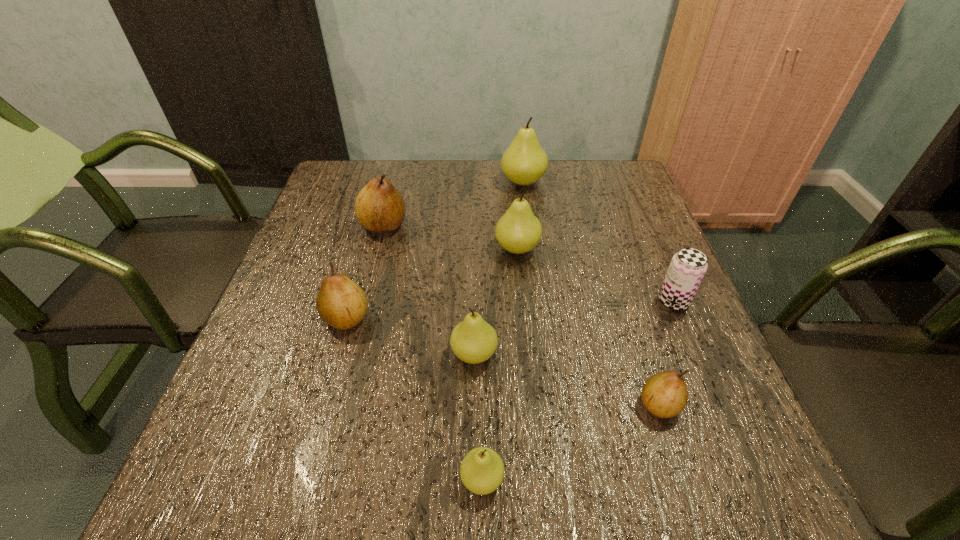
I want to click on free spot at the near right corner of the desktop, so click(682, 485).

The image size is (960, 540). Identify the location of free area in between the second nearest pear and the biggest brown pear. (521, 315).

Where is `free space that is in between the farthest object and the second nearest brown pear`? The height and width of the screenshot is (540, 960). free space that is in between the farthest object and the second nearest brown pear is located at coordinates (435, 250).

Where is `free space between the second smallest brown pear and the second biggest green pear`? This screenshot has width=960, height=540. free space between the second smallest brown pear and the second biggest green pear is located at coordinates point(432,284).

Locate an element on the screen. The width and height of the screenshot is (960, 540). free space between the rightmost object and the farthest pear is located at coordinates (598, 241).

Locate an element on the screen. This screenshot has height=540, width=960. empty space between the rightmost brown pear and the third smallest green pear is located at coordinates (588, 327).

This screenshot has width=960, height=540. What are the coordinates of `vacant area between the rightmost object and the biggest brown pear` in the screenshot? It's located at (528, 264).

This screenshot has width=960, height=540. I want to click on empty space between the farthest brown pear and the tallest pear, so click(453, 204).

Locate an element on the screen. Image resolution: width=960 pixels, height=540 pixels. unoccupied position between the third nearest green pear and the purple beer can is located at coordinates (595, 274).

Image resolution: width=960 pixels, height=540 pixels. Find the location of `empty space that is in between the third biggest green pear and the biggest brown pear`. empty space that is in between the third biggest green pear and the biggest brown pear is located at coordinates (429, 290).